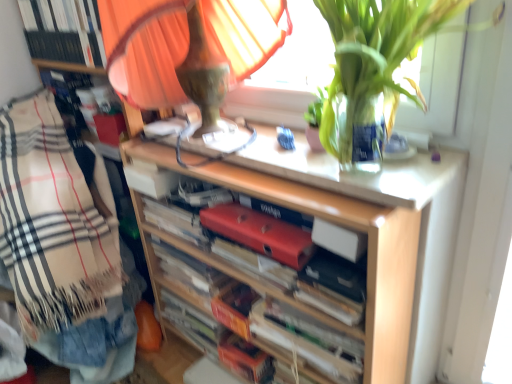
I want to click on orange cardboard book at center, which appears as the 5th book when viewed from the top, so click(x=246, y=359).

What is the approximate width of orange cardboard book at center, positioned as the 1th book in bottom-to-top order?

The width of orange cardboard book at center, positioned as the 1th book in bottom-to-top order, is 6.62 inches.

At what (x,y) coordinates should I click in order to perform the action: click on hardcover book at upper left, which appears as the second book when viewed from the top. Please return your answer as a coordinate pair (x, y). Looking at the image, I should click on (70, 100).

Measure the distance between point (x=170, y=232) and camera.

Point (x=170, y=232) is 1.37 meters from camera.

What do you see at coordinates (176, 221) in the screenshot? The height and width of the screenshot is (384, 512). I see `red matte folder at center, the 3th book when ordered from bottom to top` at bounding box center [176, 221].

What do you see at coordinates (260, 233) in the screenshot?
I see `matte red folder at center, arranged as the 2th paperback book when ordered from the bottom` at bounding box center [260, 233].

Where is `hardcover book at upper left, which is the fifth book from bottom to top`? hardcover book at upper left, which is the fifth book from bottom to top is located at coordinates (63, 30).

Locate an element on the screen. Image resolution: width=512 pixels, height=384 pixels. orange fabric lampshade at upper center is located at coordinates (185, 43).

Where is `red matte book at center, which appears as the first paperback book when viewed from the top`? red matte book at center, which appears as the first paperback book when viewed from the top is located at coordinates (278, 212).

What are the coordinates of `orange cardboard book at center, positioned as the 1th book in bottom-to-top order` in the screenshot? It's located at (246, 359).

How different are the orientations of white paper book at center, the second book positioned from the bottom, and wooden shelf at center in degrees?

The angular difference between white paper book at center, the second book positioned from the bottom, and wooden shelf at center is 0.645 degrees.

Is point (273, 311) closer to camera compared to point (371, 222)?

No, (273, 311) is behind (371, 222).

Is white paper book at center, the second book positioned from the bottom, located outside wooden shelf at center?

Actually, white paper book at center, the second book positioned from the bottom, is at least partially inside wooden shelf at center.

How distant is white paper book at center, the second book positioned from the bottom, from wooden shelf at center?

11.30 inches.

Does orange fabric lampshade at upper center have a lesser height compared to matte red folder at center, arranged as the 2th paperback book when ordered from the bottom?

In fact, orange fabric lampshade at upper center may be taller than matte red folder at center, arranged as the 2th paperback book when ordered from the bottom.

Identify the location of paperback book that is the 2nd one when counting downward from the orange fabric lampshade at upper center (from the image's perspective). (260, 233).

From a real-world perspective, is orange fabric lampshade at upper center positioned above or below matte red folder at center, arranged as the 2th paperback book when ordered from the bottom?

orange fabric lampshade at upper center is above matte red folder at center, arranged as the 2th paperback book when ordered from the bottom.

Is matte red folder at center, arranged as the 2th paperback book when ordered from the bottom, completely or partially inside orange fabric lampshade at upper center?

No, orange fabric lampshade at upper center does not contain matte red folder at center, arranged as the 2th paperback book when ordered from the bottom.

Are orange fabric lampshade at upper center and beige plaid blanket at left beside each other?

No, orange fabric lampshade at upper center is not making contact with beige plaid blanket at left.

I want to click on table lamp above the beige plaid blanket at left (from the image's perspective), so click(185, 43).

Considering the sizes of orange fabric lampshade at upper center and beige plaid blanket at left in the image, is orange fabric lampshade at upper center wider or thinner than beige plaid blanket at left?

Considering their sizes, orange fabric lampshade at upper center looks broader than beige plaid blanket at left.

Is point (285, 37) farther from camera compared to point (36, 203)?

No, it is in front of (36, 203).

Which object is closer to the camera, orange fabric lampshade at upper center or hardcover book at upper left, which is the 1th book from top to bottom?

orange fabric lampshade at upper center is more forward.

Considering the sizes of orange fabric lampshade at upper center and hardcover book at upper left, which is the 1th book from top to bottom, in the image, is orange fabric lampshade at upper center bigger or smaller than hardcover book at upper left, which is the 1th book from top to bottom,?

In the image, orange fabric lampshade at upper center appears to be larger than hardcover book at upper left, which is the 1th book from top to bottom.

Does point (128, 34) lie behind point (73, 47)?

No, (128, 34) is closer to viewer.

From the image's perspective, between orange fabric lampshade at upper center and hardcover book at upper left, which is the 1th book from top to bottom, which one is located above?

hardcover book at upper left, which is the 1th book from top to bottom.

Which of these two, beige plaid blanket at left or wooden shelf at center, is bigger?

Bigger between the two is beige plaid blanket at left.

From the image's perspective, is beige plaid blanket at left located above or below wooden shelf at center?

Based on their image positions, beige plaid blanket at left is located above wooden shelf at center.

Considering their positions, is beige plaid blanket at left located in front of or behind wooden shelf at center?

In the image, beige plaid blanket at left appears behind wooden shelf at center.

Does point (42, 290) lie behind point (453, 216)?

Yes, it is.

Which object is closer to the camera, hardcover book at upper left, which is the fifth book from bottom to top, or matte red folder at center, which appears as the second paperback book when viewed from the top?

matte red folder at center, which appears as the second paperback book when viewed from the top.

Is point (74, 4) closer to viewer compared to point (296, 241)?

No.

Based on their sizes in the image, would you say hardcover book at upper left, which is the fifth book from bottom to top, is bigger or smaller than matte red folder at center, arranged as the 2th paperback book when ordered from the bottom?

hardcover book at upper left, which is the fifth book from bottom to top, is bigger than matte red folder at center, arranged as the 2th paperback book when ordered from the bottom.

Is hardcover book at upper left, which is the fifth book from bottom to top, spatially inside matte red folder at center, which appears as the second paperback book when viewed from the top, or outside of it?

hardcover book at upper left, which is the fifth book from bottom to top, lies outside matte red folder at center, which appears as the second paperback book when viewed from the top.

Is orange fabric lampshade at upper center wider than red matte book at center, the third paperback book when ordered from bottom to top?

Yes, orange fabric lampshade at upper center is wider than red matte book at center, the third paperback book when ordered from bottom to top.

How many degrees apart are the facing directions of orange fabric lampshade at upper center and red matte book at center, the third paperback book when ordered from bottom to top?

There is a 0.359-degree angle between the facing directions of orange fabric lampshade at upper center and red matte book at center, the third paperback book when ordered from bottom to top.

Consider the image. From a real-world perspective, does orange fabric lampshade at upper center stand above red matte book at center, the third paperback book when ordered from bottom to top?

Yes.

Locate an element on the screen. Image resolution: width=512 pixels, height=384 pixels. table lamp in front of the red matte book at center, which appears as the first paperback book when viewed from the top is located at coordinates (185, 43).

At what (x,y) coordinates should I click in order to perform the action: click on the 1st book below the wooden shelf at center (from the image's perspective). Please return your answer as a coordinate pair (x, y). This screenshot has width=512, height=384. Looking at the image, I should click on (313, 336).

At what (x,y) coordinates should I click in order to perform the action: click on paperback book that is the 3rd one below the orange fabric lampshade at upper center (from a real-world perspective). Please return your answer as a coordinate pair (x, y). Image resolution: width=512 pixels, height=384 pixels. Looking at the image, I should click on (260, 233).

When comparing their distances from beige plaid blanket at left, does orange fabric lampshade at upper center or matte red folder at center, arranged as the 2th paperback book when ordered from the bottom, seem closer?

Based on the image, orange fabric lampshade at upper center appears to be nearer to beige plaid blanket at left.

When comparing their distances from red matte folder at center, the 3th book when ordered from bottom to top, does orange fabric lampshade at upper center or red matte book at center, the third paperback book when ordered from bottom to top, seem further?

orange fabric lampshade at upper center is positioned further to the anchor red matte folder at center, the 3th book when ordered from bottom to top.

Based on their spatial positions, is hardcover book at upper left, which appears as the second book when viewed from the top, or hardcover book at center, which is counted as the 3th paperback book, starting from the top, further from orange fabric lampshade at upper center?

hardcover book at center, which is counted as the 3th paperback book, starting from the top, is further to orange fabric lampshade at upper center.

Looking at this image, considering their positions, is orange cardboard book at center, which appears as the 5th book when viewed from the top, positioned closer to wooden shelf at center than hardcover book at upper left, placed as the 4th book when sorted from bottom to top?

Among the two, orange cardboard book at center, which appears as the 5th book when viewed from the top, is located nearer to wooden shelf at center.

When comparing their distances from red matte book at center, the third paperback book when ordered from bottom to top, does hardcover book at upper left, placed as the 4th book when sorted from bottom to top, or red matte folder at center, arranged as the 3th book when viewed from the top, seem further?

Based on the image, hardcover book at upper left, placed as the 4th book when sorted from bottom to top, appears to be further to red matte book at center, the third paperback book when ordered from bottom to top.

From the image, which object appears to be nearer to orange cardboard book at center, positioned as the 1th book in bottom-to-top order, hardcover book at center, which is the first paperback book in bottom-to-top order, or hardcover book at upper left, which is the fifth book from bottom to top?

hardcover book at center, which is the first paperback book in bottom-to-top order, lies closer to orange cardboard book at center, positioned as the 1th book in bottom-to-top order, than the other object.

Looking at the image, which one is located closer to beige plaid blanket at left, hardcover book at upper left, which is the fifth book from bottom to top, or orange cardboard book at center, which appears as the 5th book when viewed from the top?

hardcover book at upper left, which is the fifth book from bottom to top.

From the image, which object appears to be nearer to orange cardboard book at center, positioned as the 1th book in bottom-to-top order, beige plaid blanket at left or hardcover book at upper left, which is the 1th book from top to bottom?

beige plaid blanket at left.

Identify the location of table lamp between beige plaid blanket at left and wooden shelf at center in the horizontal direction. (185, 43).

Locate an element on the screen. This screenshot has width=512, height=384. shelf between red matte book at center, which appears as the first paperback book when viewed from the top, and white paper book at center, the second book positioned from the bottom, in the vertical direction is located at coordinates (365, 232).

Locate an element on the screen. paperback book between matte red folder at center, which appears as the second paperback book when viewed from the top, and orange cardboard book at center, positioned as the 1th book in bottom-to-top order, in the vertical direction is located at coordinates (336, 275).

The width and height of the screenshot is (512, 384). I want to click on paperback book between hardcover book at upper left, which is the 1th book from top to bottom, and red matte book at center, which appears as the first paperback book when viewed from the top, so click(260, 233).